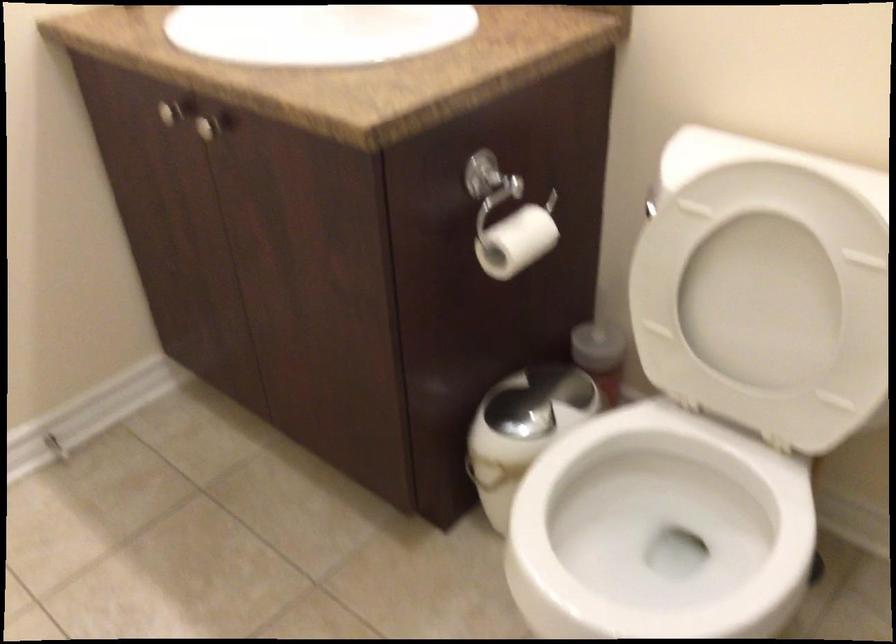
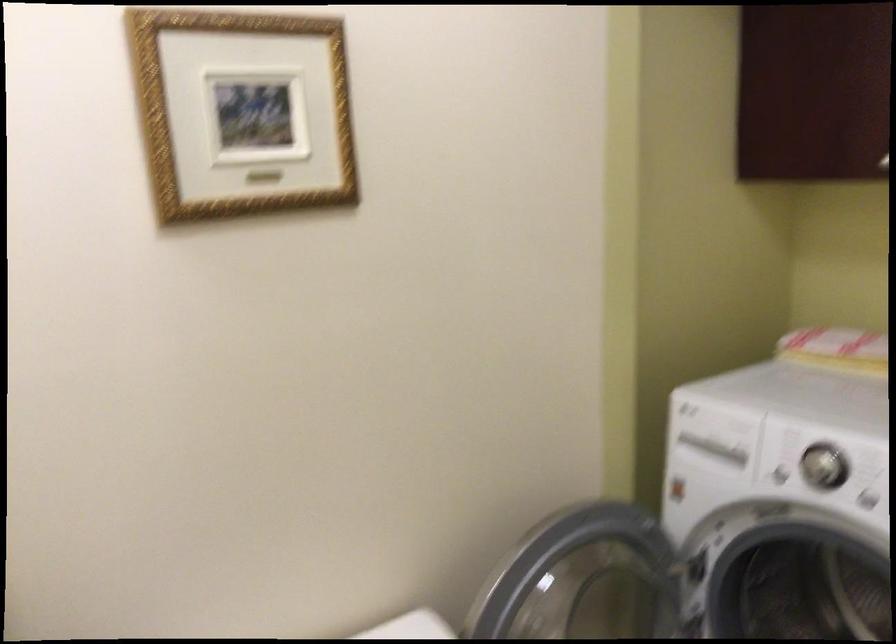
Question: The camera is either moving clockwise (left) or counter-clockwise (right) around the object. The first image is from the beginning of the video and the second image is from the end. Is the camera moving left or right when shooting the video?

Choices:
 (A) Left
 (B) Right

Answer: (A)